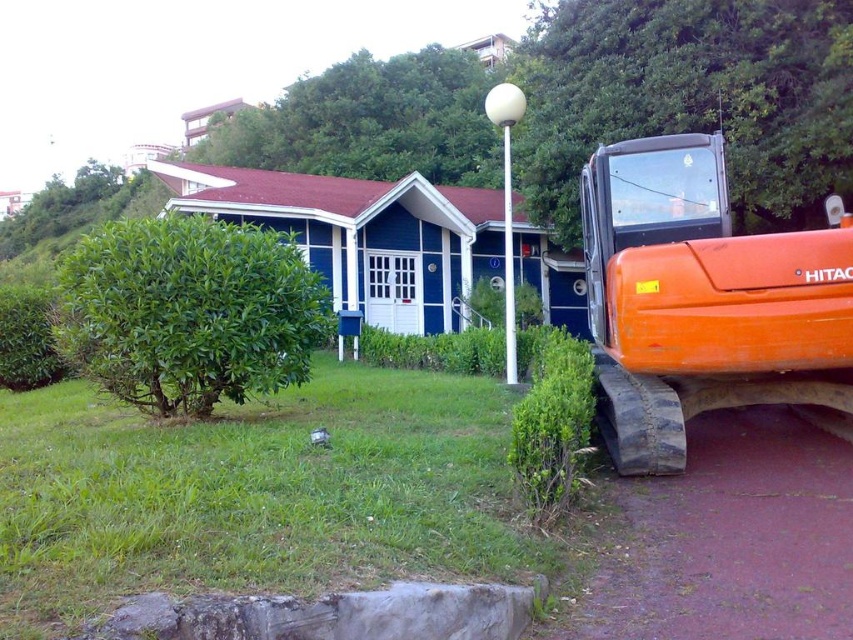
Question: Is green grass at lower left bigger than orange rubber tractor at right?

Choices:
 (A) no
 (B) yes

Answer: (A)

Question: Does green grass at lower left come behind orange rubber tractor at right?

Choices:
 (A) yes
 (B) no

Answer: (B)

Question: Which point is closer to the camera?

Choices:
 (A) (668, 314)
 (B) (28, 467)

Answer: (B)

Question: Does green grass at lower left appear on the right side of orange rubber tractor at right?

Choices:
 (A) no
 (B) yes

Answer: (A)